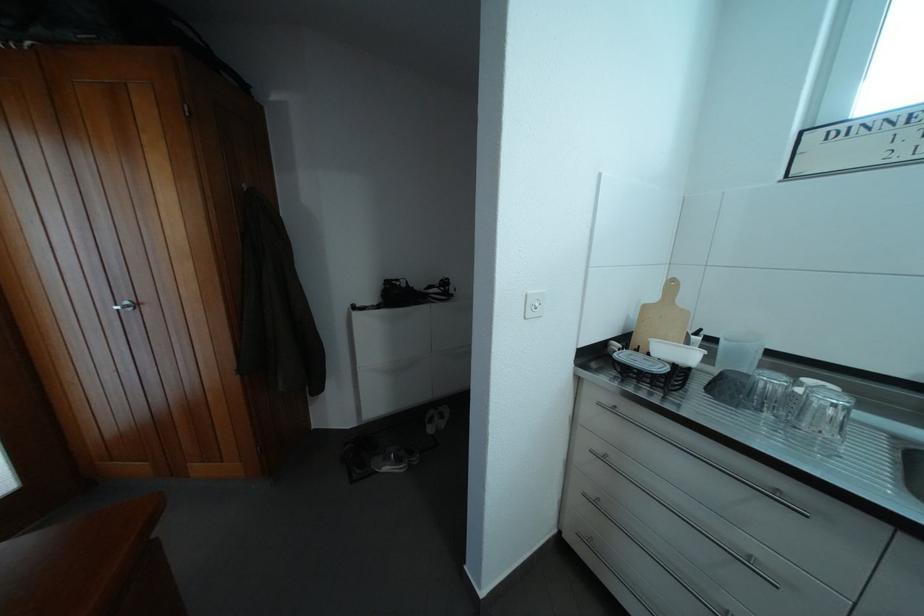
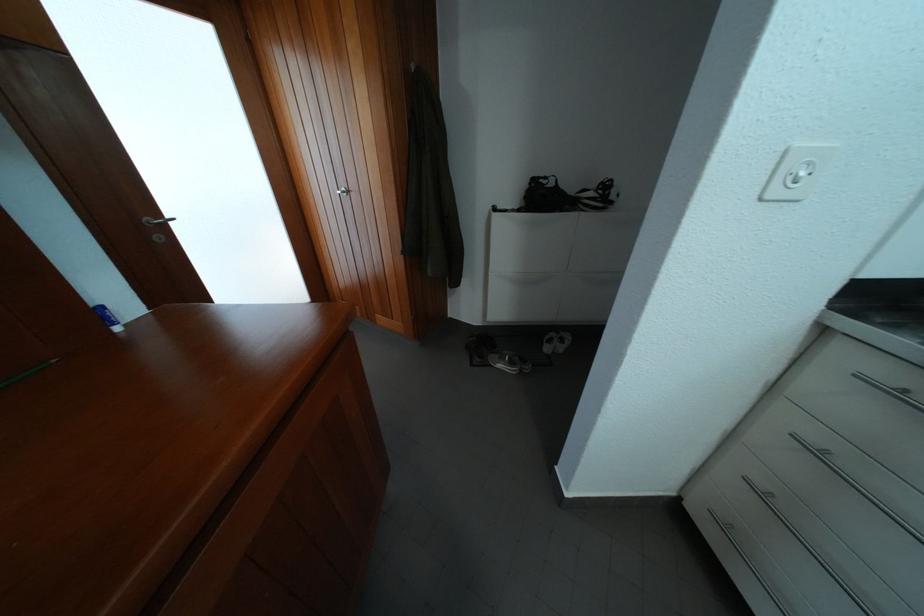
The point at (539, 298) is marked in the first image. Where is the corresponding point in the second image?

(806, 150)